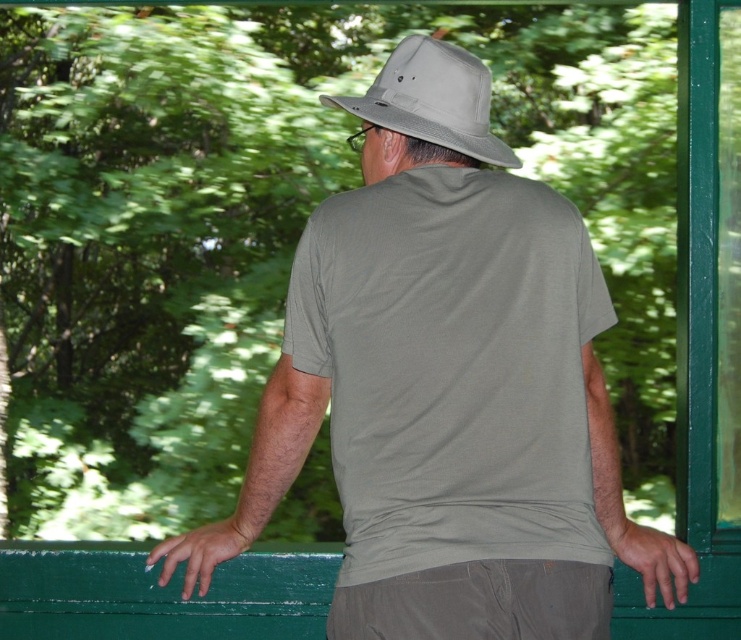
Who is more forward, (459,400) or (442,64)?

Point (459,400)

Which is in front, point (475, 97) or point (485, 83)?

Point (475, 97)

Locate an element on the screen. This screenshot has width=741, height=640. matte khaki hat at center is located at coordinates (445, 387).